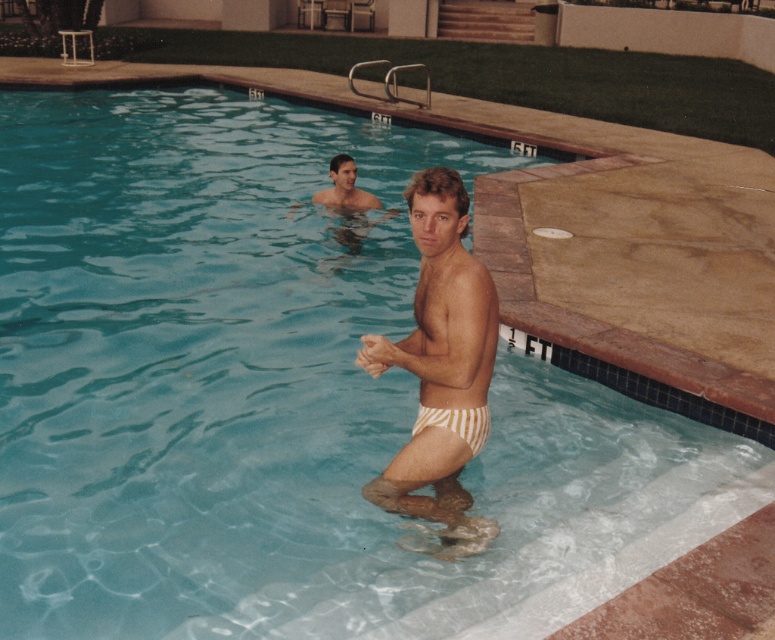
Looking at this image, you are at the pool and want to know which object is wider between the white striped swimsuit at center and the white striped fabric at lower center. Which one is wider?

Result: The white striped swimsuit at center is wider than the white striped fabric at lower center.

You are a lifeguard observing the pool area. You notice two white striped items in the water. The first is the white striped swimsuit at center, and the second is the white striped fabric at lower center. Which of these items is bigger in size?

The white striped swimsuit at center is larger in size compared to the white striped fabric at lower center.

You are a photographer trying to capture a clear shot of both the white striped swimsuit at center and the white striped fabric at lower center. Which object should you focus on first to ensure both are in focus?

You should focus on the white striped swimsuit at center first because it is closer to the viewer than the white striped fabric at lower center, so adjusting focus from near to far will help both be in focus.